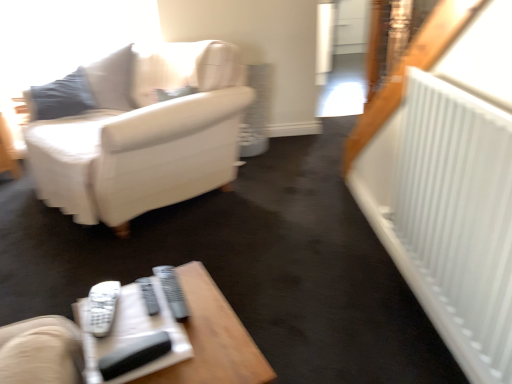
Identify the location of vacant space situated above wooden table at lower center (from a real-world perspective). (168, 330).